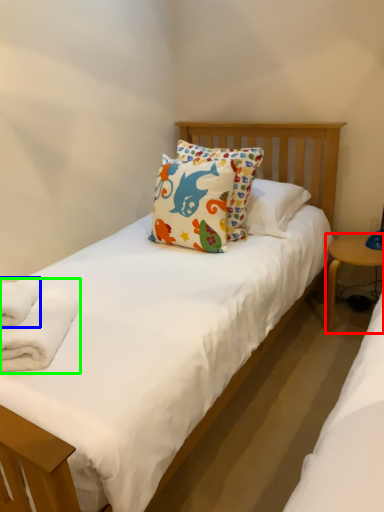
Question: Considering the real-world distances, which object is closest to table (highlighted by a red box)? bath towel (highlighted by a blue box) or bath towel (highlighted by a green box).

Choices:
 (A) bath towel
 (B) bath towel

Answer: (B)